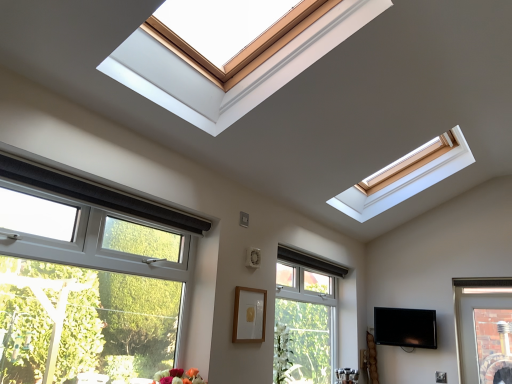
Question: Can you confirm if white plastic window at lower left, which ranks as the first window in left-to-right order, is shorter than clear glass window at center, which appears as the 1th window when viewed from the right?

Choices:
 (A) yes
 (B) no

Answer: (A)

Question: Is white plastic window at lower left, the first window in the front-to-back sequence, turned away from clear glass window at center, the first window from the back?

Choices:
 (A) yes
 (B) no

Answer: (B)

Question: Does white plastic window at lower left, the first window in the front-to-back sequence, have a larger size compared to clear glass window at center, the first window from the back?

Choices:
 (A) yes
 (B) no

Answer: (B)

Question: From a real-world perspective, does white plastic window at lower left, which ranks as the first window in left-to-right order, stand above clear glass window at center, which appears as the 1th window when viewed from the right?

Choices:
 (A) no
 (B) yes

Answer: (B)

Question: Does white plastic window at lower left, the second window viewed from the right, have a greater width compared to clear glass window at center, the first window from the back?

Choices:
 (A) yes
 (B) no

Answer: (B)

Question: From a real-world perspective, is white plastic window at lower left, which ranks as the first window in left-to-right order, below clear glass window at center, the 2th window from the left?

Choices:
 (A) no
 (B) yes

Answer: (A)

Question: Is white glossy vase at center directly adjacent to clear glass window at center, the first window from the back?

Choices:
 (A) no
 (B) yes

Answer: (A)

Question: Is white glossy vase at center closer to the viewer compared to clear glass window at center, placed as the second window when sorted from front to back?

Choices:
 (A) no
 (B) yes

Answer: (B)

Question: Does white glossy vase at center appear on the left side of clear glass window at center, which appears as the 1th window when viewed from the right?

Choices:
 (A) yes
 (B) no

Answer: (A)

Question: Is white glossy vase at center facing towards clear glass window at center, the 2th window from the left?

Choices:
 (A) yes
 (B) no

Answer: (B)

Question: Does white glossy vase at center have a greater height compared to clear glass window at center, the 2th window from the left?

Choices:
 (A) yes
 (B) no

Answer: (B)

Question: Is the position of white glossy vase at center more distant than that of clear glass window at center, the 2th window from the left?

Choices:
 (A) yes
 (B) no

Answer: (B)

Question: Is the position of black glossy tv at lower right less distant than that of clear glass window at center, which appears as the 1th window when viewed from the right?

Choices:
 (A) no
 (B) yes

Answer: (A)